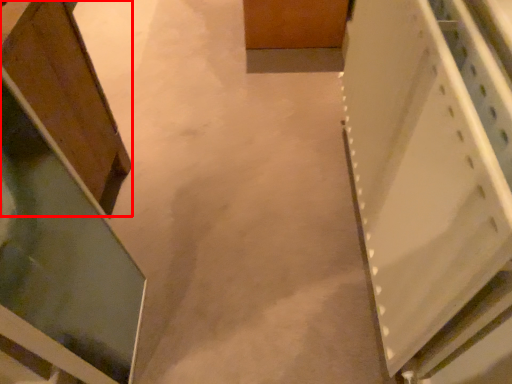
Question: In this image, where is cabinetry (annotated by the red box) located relative to cabinetry?

Choices:
 (A) left
 (B) right

Answer: (A)